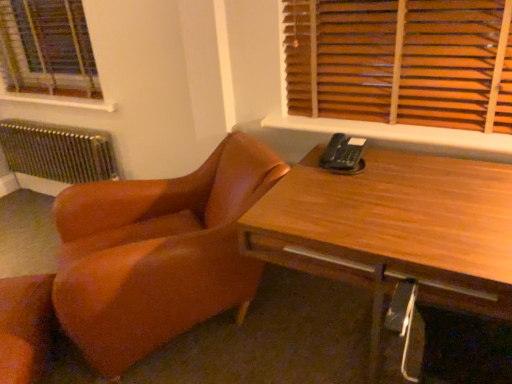
At what (x,y) coordinates should I click in order to perform the action: click on wooden at upper right, the second window sill from the back. Please return your answer as a coordinate pair (x, y). The image size is (512, 384). Looking at the image, I should click on (396, 133).

Describe the element at coordinates (157, 253) in the screenshot. The image size is (512, 384). I see `brown leather chair at left, positioned as the second chair in left-to-right order` at that location.

This screenshot has height=384, width=512. I want to click on leather at lower left, the second chair from the right, so click(x=25, y=327).

This screenshot has width=512, height=384. Find the location of `metallic radiator at left`. metallic radiator at left is located at coordinates (58, 151).

What do you see at coordinates (58, 151) in the screenshot?
I see `metallic radiator at left` at bounding box center [58, 151].

What do you see at coordinates (58, 101) in the screenshot? I see `white wood window sill at upper left, the 2th window sill from the right` at bounding box center [58, 101].

I want to click on wooden blinds at upper right, so click(448, 62).

Are leather at lower left, the 1th chair positioned from the left, and wooden blinds at upper left far apart?

Yes.

Between leather at lower left, the second chair from the right, and wooden blinds at upper left, which one has more height?

wooden blinds at upper left.

Does leather at lower left, the second chair from the right, have a lesser width compared to wooden blinds at upper left?

No, leather at lower left, the second chair from the right, is not thinner than wooden blinds at upper left.

Is wooden blinds at upper left at the back of leather at lower left, the 1th chair positioned from the left?

That's not correct — leather at lower left, the 1th chair positioned from the left, is not looking away from wooden blinds at upper left.

Is brown leather chair at left, positioned as the second chair in left-to-right order, spatially inside white wood window sill at upper left, which ranks as the 1th window sill in back-to-front order, or outside of it?

brown leather chair at left, positioned as the second chair in left-to-right order, is not enclosed by white wood window sill at upper left, which ranks as the 1th window sill in back-to-front order.

Considering the sizes of brown leather chair at left, the 1th chair from the right, and white wood window sill at upper left, marked as the second window sill in a bottom-to-top arrangement, in the image, is brown leather chair at left, the 1th chair from the right, bigger or smaller than white wood window sill at upper left, marked as the second window sill in a bottom-to-top arrangement,?

Clearly, brown leather chair at left, the 1th chair from the right, is larger in size than white wood window sill at upper left, marked as the second window sill in a bottom-to-top arrangement.

Does point (254, 147) come in front of point (24, 96)?

Yes.

Is brown leather chair at left, the 1th chair from the right, positioned before white wood window sill at upper left, which ranks as the 1th window sill in back-to-front order?

Yes, brown leather chair at left, the 1th chair from the right, is closer to the viewer.

From the image's perspective, between wooden at upper right, the 1th window sill ordered from the bottom, and wooden blinds at upper right, which one is located above?

wooden blinds at upper right is shown above in the image.

Considering the sizes of objects wooden at upper right, acting as the first window sill starting from the front, and wooden blinds at upper right in the image provided, who is shorter, wooden at upper right, acting as the first window sill starting from the front, or wooden blinds at upper right?

wooden at upper right, acting as the first window sill starting from the front.

Which point is more forward, (382, 123) or (338, 17)?

Point (338, 17)

At what (x,y) coordinates should I click in order to perform the action: click on the 2nd window sill positioned below the wooden blinds at upper right (from a real-world perspective). Please return your answer as a coordinate pair (x, y). Looking at the image, I should click on (396, 133).

Where is `window located behind the brown leather chair at left, positioned as the second chair in left-to-right order`? Image resolution: width=512 pixels, height=384 pixels. window located behind the brown leather chair at left, positioned as the second chair in left-to-right order is located at coordinates (47, 49).

Based on the photo, is brown leather chair at left, the 1th chair from the right, positioned with its back to wooden blinds at upper left?

No, brown leather chair at left, the 1th chair from the right, is not facing the opposite direction of wooden blinds at upper left.

In the image, is brown leather chair at left, the 1th chair from the right, positioned in front of or behind wooden blinds at upper left?

brown leather chair at left, the 1th chair from the right, is positioned closer to the viewer than wooden blinds at upper left.

Does brown leather chair at left, the 1th chair from the right, have a greater height compared to wooden at upper right, acting as the first window sill starting from the front?

Yes.

Which point is more distant from viewer, [93,238] or [284,123]?

The point [284,123] is farther from the camera.

Is brown leather chair at left, positioned as the second chair in left-to-right order, smaller than wooden at upper right, acting as the first window sill starting from the front?

Incorrect, brown leather chair at left, positioned as the second chair in left-to-right order, is not smaller in size than wooden at upper right, acting as the first window sill starting from the front.

Would you say brown leather chair at left, positioned as the second chair in left-to-right order, is to the left or to the right of wooden blinds at upper right in the picture?

brown leather chair at left, positioned as the second chair in left-to-right order, is positioned on wooden blinds at upper right's left side.

Which point is more distant from viewer, (204, 279) or (418, 112)?

Positioned behind is point (418, 112).

From the image's perspective, which is below, metallic radiator at left or wooden at upper right, the second window sill from the back?

metallic radiator at left.

Considering their positions, is metallic radiator at left located in front of or behind wooden at upper right, marked as the 1th window sill in a right-to-left arrangement?

Visually, metallic radiator at left is located behind wooden at upper right, marked as the 1th window sill in a right-to-left arrangement.

Is metallic radiator at left not near wooden at upper right, placed as the 2th window sill when sorted from left to right?

That's right, there is a large distance between metallic radiator at left and wooden at upper right, placed as the 2th window sill when sorted from left to right.

This screenshot has height=384, width=512. In order to click on the 1st chair in front of the wooden blinds at upper left in this screenshot , I will do `click(25, 327)`.

The height and width of the screenshot is (384, 512). Find the location of `chair that is the 1st one when counting downward from the white wood window sill at upper left, marked as the second window sill in a bottom-to-top arrangement (from the image's perspective)`. chair that is the 1st one when counting downward from the white wood window sill at upper left, marked as the second window sill in a bottom-to-top arrangement (from the image's perspective) is located at coordinates (157, 253).

When comparing their distances from wooden desk at center, does white wood window sill at upper left, marked as the 2th window sill in a front-to-back arrangement, or wooden blinds at upper left seem further?

The object further to wooden desk at center is wooden blinds at upper left.

Estimate the real-world distances between objects in this image. Which object is further from wooden blinds at upper right, metallic radiator at left or wooden desk at center?

metallic radiator at left is further to wooden blinds at upper right.

Based on their spatial positions, is wooden blinds at upper left or brown leather chair at left, positioned as the second chair in left-to-right order, closer to wooden desk at center?

The object closer to wooden desk at center is brown leather chair at left, positioned as the second chair in left-to-right order.

Based on their spatial positions, is leather at lower left, the 1th chair positioned from the left, or wooden blinds at upper left further from white wood window sill at upper left, the 2th window sill from the right?

The object further to white wood window sill at upper left, the 2th window sill from the right, is leather at lower left, the 1th chair positioned from the left.

Based on the photo, which object lies further to the anchor point brown leather chair at left, the 1th chair from the right, leather at lower left, the 1th chair positioned from the left, or wooden at upper right, placed as the 2th window sill when sorted from left to right?

wooden at upper right, placed as the 2th window sill when sorted from left to right, is further to brown leather chair at left, the 1th chair from the right.

Considering their positions, is wooden blinds at upper right positioned further to leather at lower left, the second chair from the right, than brown leather chair at left, positioned as the second chair in left-to-right order?

wooden blinds at upper right lies further to leather at lower left, the second chair from the right, than the other object.

Considering their positions, is wooden blinds at upper right positioned closer to wooden desk at center than wooden blinds at upper left?

wooden blinds at upper right.

Based on their spatial positions, is wooden blinds at upper left or leather at lower left, the second chair from the right, further from metallic radiator at left?

leather at lower left, the second chair from the right, lies further to metallic radiator at left than the other object.

At what (x,y) coordinates should I click in order to perform the action: click on window sill situated between wooden blinds at upper left and wooden desk at center from left to right. Please return your answer as a coordinate pair (x, y). Image resolution: width=512 pixels, height=384 pixels. Looking at the image, I should click on (396, 133).

Find the location of a particular element. desk situated between wooden blinds at upper left and wooden blinds at upper right from left to right is located at coordinates (394, 236).

What are the coordinates of `window situated between white wood window sill at upper left, which is the first window sill from top to bottom, and wooden blinds at upper right from left to right` in the screenshot? It's located at (47, 49).

Identify the location of radiator that lies between wooden blinds at upper left and leather at lower left, the 1th chair positioned from the left, from top to bottom. The height and width of the screenshot is (384, 512). (58, 151).